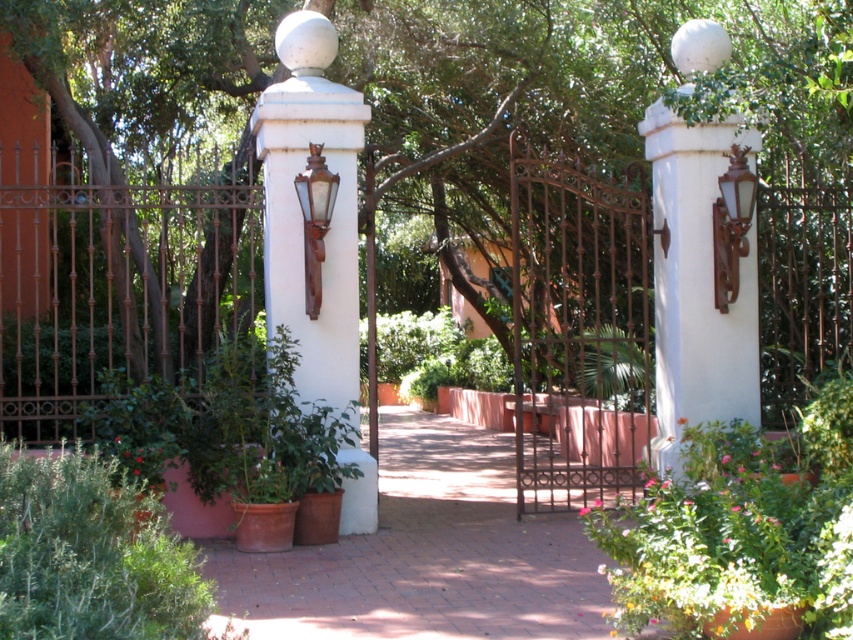
Question: Is the position of rusty iron gate at center less distant than that of white painted stone wall at upper right?

Choices:
 (A) yes
 (B) no

Answer: (A)

Question: Does terracotta brick path at center appear under white painted stone wall at upper right?

Choices:
 (A) yes
 (B) no

Answer: (A)

Question: Which of the following is the closest to the observer?

Choices:
 (A) (654, 122)
 (B) (16, 456)
 (C) (227, 579)

Answer: (B)

Question: Which object appears farthest from the camera in this image?

Choices:
 (A) white painted stone column at center
 (B) terracotta brick path at center
 (C) white painted stone wall at upper right
 (D) green leafy plant at center

Answer: (C)

Question: Which object is closer to the camera taking this photo?

Choices:
 (A) white painted stone column at center
 (B) white painted stone wall at upper right
 (C) terracotta brick path at center

Answer: (C)

Question: Does green fuzzy bush at lower left come behind white painted stone column at center?

Choices:
 (A) yes
 (B) no

Answer: (B)